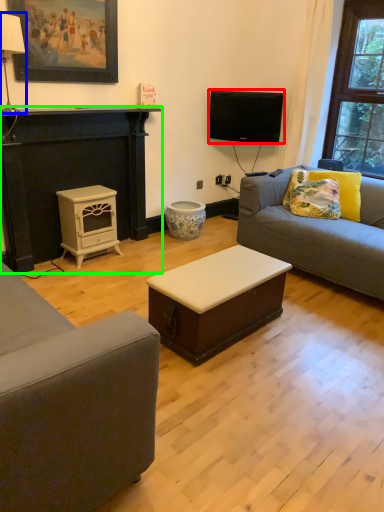
Question: Which object is the closest to the television (highlighted by a red box)? Choose among these: lamp (highlighted by a blue box) or fireplace (highlighted by a green box).

Choices:
 (A) lamp
 (B) fireplace

Answer: (B)